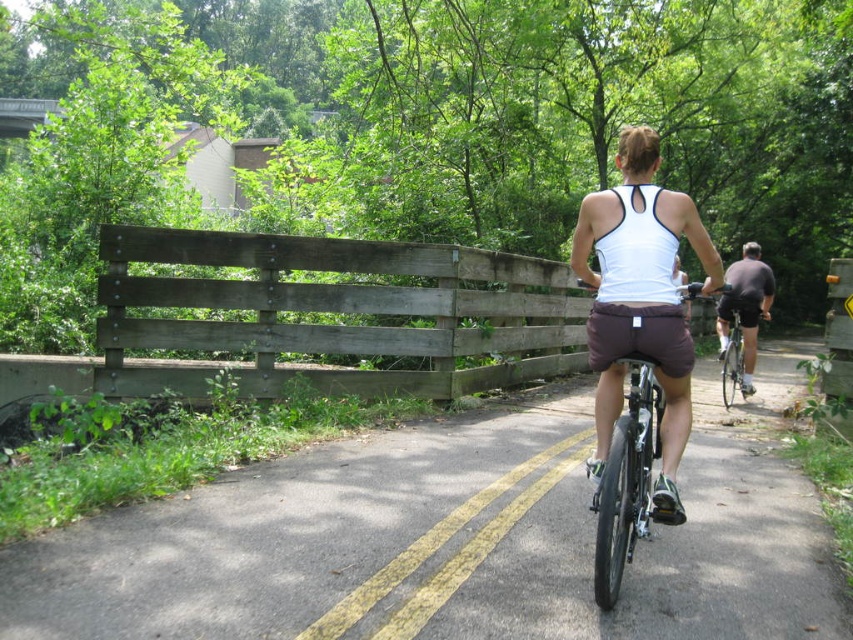
You are a cyclist observing the woman from behind. Which clothing item is shorter in height between the white fabric tank top at center and the dark gray fabric shorts at right?

The white fabric tank top at center is shorter in height than the dark gray fabric shorts at right.

You are a cyclist approaching the asphalt road at center and dark gray fabric shorts at right. Which object is positioned to the left?

The asphalt road at center is to the left of dark gray fabric shorts at right, so the asphalt road at center is positioned to the left.

You are a cyclist planning to ride along the asphalt road at center. You have a pair of dark gray fabric shorts at right that you want to place on the road. Will the shorts fit entirely on the road?

The asphalt road at center has a smaller size compared to dark gray fabric shorts at right, so the shorts will not fit entirely on the road.